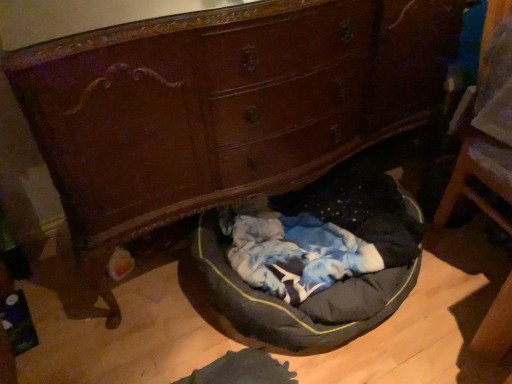
Looking at this image, measure the distance between point [489,156] and camera.

Point [489,156] is 3.76 feet from camera.

Describe the element at coordinates (487, 124) in the screenshot. Image resolution: width=512 pixels, height=384 pixels. I see `wooden chair at right` at that location.

The height and width of the screenshot is (384, 512). Find the location of `wooden chair at right`. wooden chair at right is located at coordinates (487, 124).

Locate an element on the screen. The height and width of the screenshot is (384, 512). black fabric dog bed at center is located at coordinates (284, 303).

The height and width of the screenshot is (384, 512). Describe the element at coordinates (284, 303) in the screenshot. I see `black fabric dog bed at center` at that location.

The image size is (512, 384). Find the location of `wooden chair at right`. wooden chair at right is located at coordinates (487, 124).

Which object is positioned more to the left, wooden chair at right or black fabric dog bed at center?

black fabric dog bed at center.

Is the position of wooden chair at right more distant than that of black fabric dog bed at center?

No, wooden chair at right is closer to the camera.

Is point (450, 210) less distant than point (246, 343)?

That is False.

From the image's perspective, which one is positioned higher, wooden chair at right or black fabric dog bed at center?

wooden chair at right, from the image's perspective.

From a real-world perspective, which is physically below, wooden chair at right or black fabric dog bed at center?

black fabric dog bed at center, from a real-world perspective.

Is wooden chair at right wider than black fabric dog bed at center?

No, wooden chair at right is not wider than black fabric dog bed at center.

Which of these two, wooden chair at right or black fabric dog bed at center, stands taller?

wooden chair at right.

Does wooden chair at right have a larger size compared to black fabric dog bed at center?

No.

Is wooden chair at right spatially inside black fabric dog bed at center, or outside of it?

wooden chair at right exists outside the volume of black fabric dog bed at center.

Are wooden chair at right and black fabric dog bed at center far apart?

No, wooden chair at right is not far away from black fabric dog bed at center.

Is wooden chair at right positioned with its back to black fabric dog bed at center?

No, wooden chair at right is not facing the opposite direction of black fabric dog bed at center.

How far apart are wooden chair at right and black fabric dog bed at center?

wooden chair at right is 22.40 inches from black fabric dog bed at center.

Where is `dog bed to the left of wooden chair at right`? Image resolution: width=512 pixels, height=384 pixels. dog bed to the left of wooden chair at right is located at coordinates (284, 303).

Consider the image. Between black fabric dog bed at center and wooden chair at right, which one appears on the left side from the viewer's perspective?

black fabric dog bed at center is more to the left.

Which object is closer to the camera, black fabric dog bed at center or wooden chair at right?

Positioned in front is wooden chair at right.

Is point (294, 355) more distant than point (507, 280)?

That is False.

From the image's perspective, is black fabric dog bed at center positioned above or below wooden chair at right?

Clearly, from the image's perspective, black fabric dog bed at center is below wooden chair at right.

From a real-world perspective, is black fabric dog bed at center physically located above or below wooden chair at right?

black fabric dog bed at center is situated lower than wooden chair at right in the real world.

Which object is thinner, black fabric dog bed at center or wooden chair at right?

Thinner between the two is wooden chair at right.

Considering the sizes of objects black fabric dog bed at center and wooden chair at right in the image provided, who is taller, black fabric dog bed at center or wooden chair at right?

wooden chair at right is taller.

Considering the sizes of black fabric dog bed at center and wooden chair at right in the image, is black fabric dog bed at center bigger or smaller than wooden chair at right?

Considering their sizes, black fabric dog bed at center takes up more space than wooden chair at right.

Is black fabric dog bed at center completely or partially outside of wooden chair at right?

That's correct, black fabric dog bed at center is outside of wooden chair at right.

Is the surface of black fabric dog bed at center in direct contact with wooden chair at right?

No, black fabric dog bed at center is not beside wooden chair at right.

Is black fabric dog bed at center positioned with its back to wooden chair at right?

That's not correct — black fabric dog bed at center is not looking away from wooden chair at right.

Can you tell me how much black fabric dog bed at center and wooden chair at right differ in facing direction?

4.93 degrees.

How distant is black fabric dog bed at center from wooden chair at right?

black fabric dog bed at center is 56.90 centimeters away from wooden chair at right.

You are a GUI agent. You are given a task and a screenshot of the screen. Output one action in this format:
    pyautogui.click(x=<x>, y=<y>)
    Task: Click on the dog bed that is behind the wooden chair at right
    This screenshot has height=384, width=512.
    Given the screenshot: What is the action you would take?
    pyautogui.click(x=284, y=303)

This screenshot has height=384, width=512. I want to click on dog bed below the wooden chair at right (from the image's perspective), so click(284, 303).

At what (x,y) coordinates should I click in order to perform the action: click on furniture located in front of the black fabric dog bed at center. Please return your answer as a coordinate pair (x, y). Looking at the image, I should click on (487, 124).